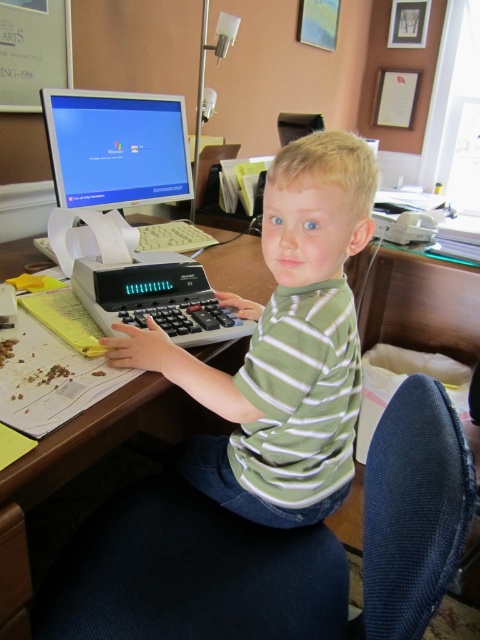
Does wooden table at center appear under gray plastic calculator at lower left?

Correct, wooden table at center is located below gray plastic calculator at lower left.

Can you confirm if wooden table at center is smaller than gray plastic calculator at lower left?

No.

What do you see at coordinates (81, 470) in the screenshot? I see `wooden table at center` at bounding box center [81, 470].

The height and width of the screenshot is (640, 480). What are the coordinates of `wooden table at center` in the screenshot? It's located at (81, 470).

Based on the photo, between matte plastic monitor at upper left and gray plastic calculator at lower left, which one has less height?

gray plastic calculator at lower left

Measure the distance from matte plastic monitor at upper left to gray plastic calculator at lower left.

matte plastic monitor at upper left is 17.11 inches from gray plastic calculator at lower left.

Image resolution: width=480 pixels, height=640 pixels. What do you see at coordinates (116, 147) in the screenshot?
I see `matte plastic monitor at upper left` at bounding box center [116, 147].

At what (x,y) coordinates should I click in order to perform the action: click on matte plastic monitor at upper left. Please return your answer as a coordinate pair (x, y). Looking at the image, I should click on (116, 147).

Is wooden table at center closer to camera compared to matte plastic monitor at upper left?

That is True.

Can you confirm if wooden table at center is wider than matte plastic monitor at upper left?

Indeed, wooden table at center has a greater width compared to matte plastic monitor at upper left.

Who is more forward, (116, 410) or (184, 166)?

Point (116, 410) is more forward.

You are a GUI agent. You are given a task and a screenshot of the screen. Output one action in this format:
    pyautogui.click(x=<x>, y=<y>)
    Task: Click on the wooden table at center
    
    Given the screenshot: What is the action you would take?
    pyautogui.click(x=81, y=470)